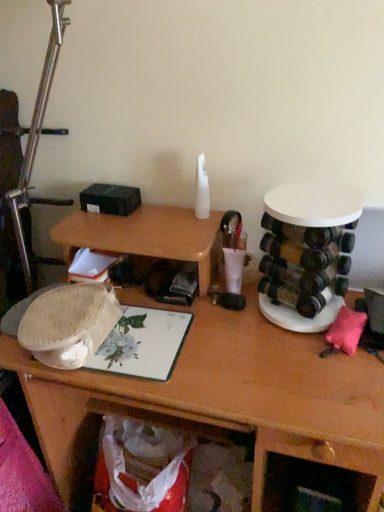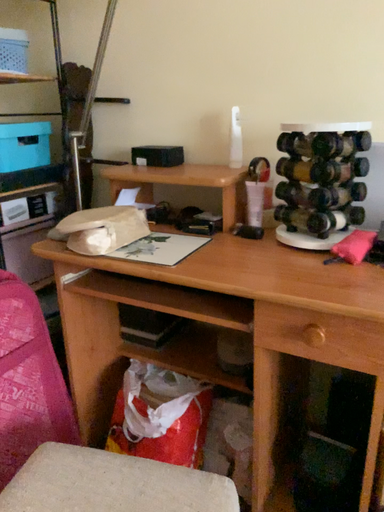
Question: Which way did the camera rotate in the video?

Choices:
 (A) rotated downward
 (B) rotated upward

Answer: (B)